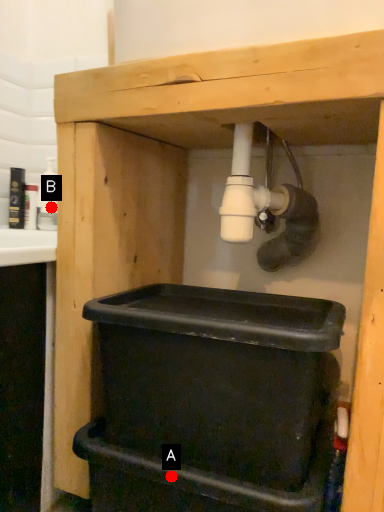
Question: Two points are circled on the image, labeled by A and B beside each circle. Which point appears farthest from the camera in this image?

Choices:
 (A) A is further
 (B) B is further

Answer: (B)